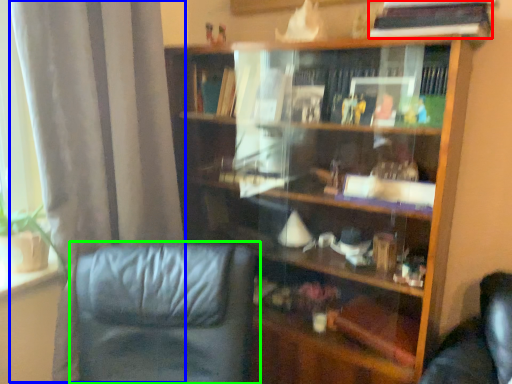
Question: Based on their relative distances, which object is nearer to book (highlighted by a red box)? Choose from curtain (highlighted by a blue box) and chair (highlighted by a green box).

Choices:
 (A) curtain
 (B) chair

Answer: (A)